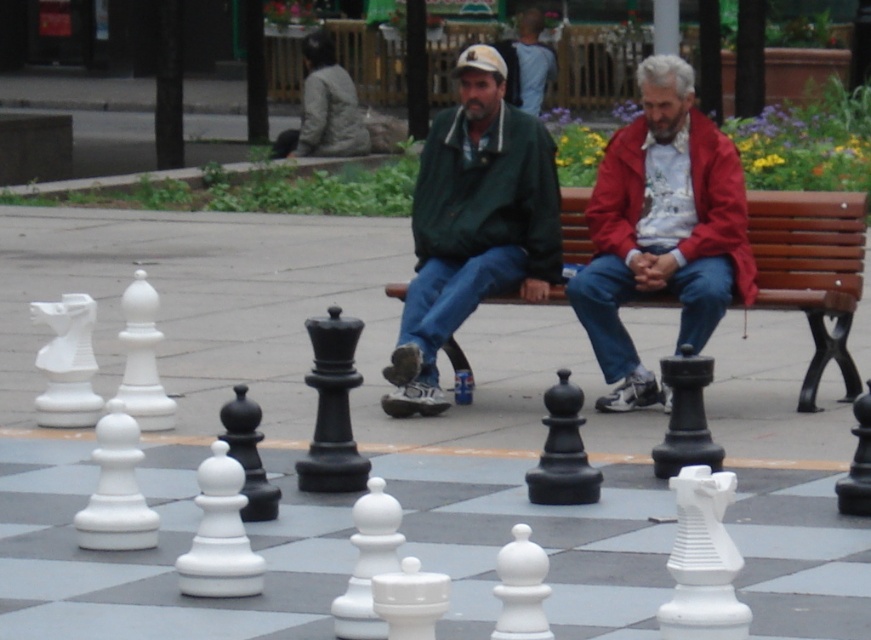
Question: Is green matte jacket at center thinner than beech wood bench at center?

Choices:
 (A) no
 (B) yes

Answer: (A)

Question: Is green matte jacket at center bigger than beech wood bench at center?

Choices:
 (A) no
 (B) yes

Answer: (B)

Question: Among these objects, which one is farthest from the camera?

Choices:
 (A) green matte jacket at center
 (B) beech wood bench at center

Answer: (B)

Question: Among these objects, which one is nearest to the camera?

Choices:
 (A) beech wood bench at center
 (B) green matte jacket at center

Answer: (B)

Question: Does red matte jacket at center appear over green matte jacket at center?

Choices:
 (A) no
 (B) yes

Answer: (B)

Question: Which is nearer to the beech wood bench at center?

Choices:
 (A) green matte jacket at center
 (B) red matte jacket at center

Answer: (B)